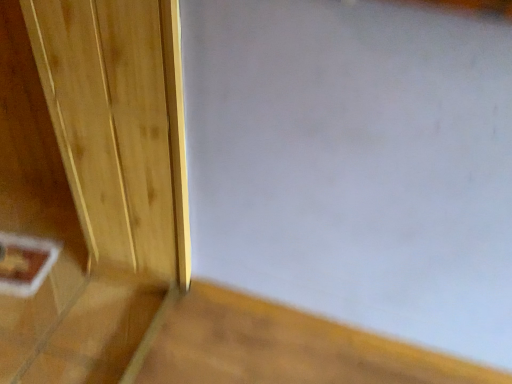
What do you see at coordinates (283, 348) in the screenshot?
I see `matte wood plywood at lower right` at bounding box center [283, 348].

I want to click on matte wood plywood at lower right, so click(283, 348).

Where is `matte wood plywood at lower right`? matte wood plywood at lower right is located at coordinates (283, 348).